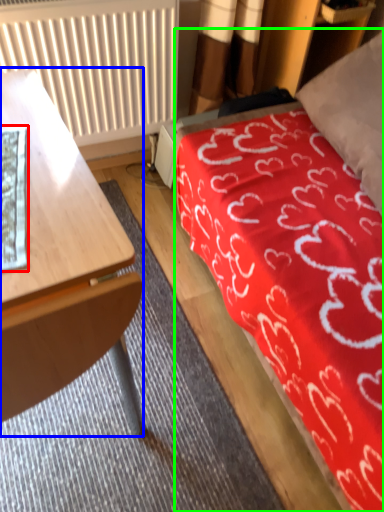
Question: Which object is the farthest from sheet (highlighted by a red box)? Choose among these: desk (highlighted by a blue box) or bed (highlighted by a green box).

Choices:
 (A) desk
 (B) bed

Answer: (B)